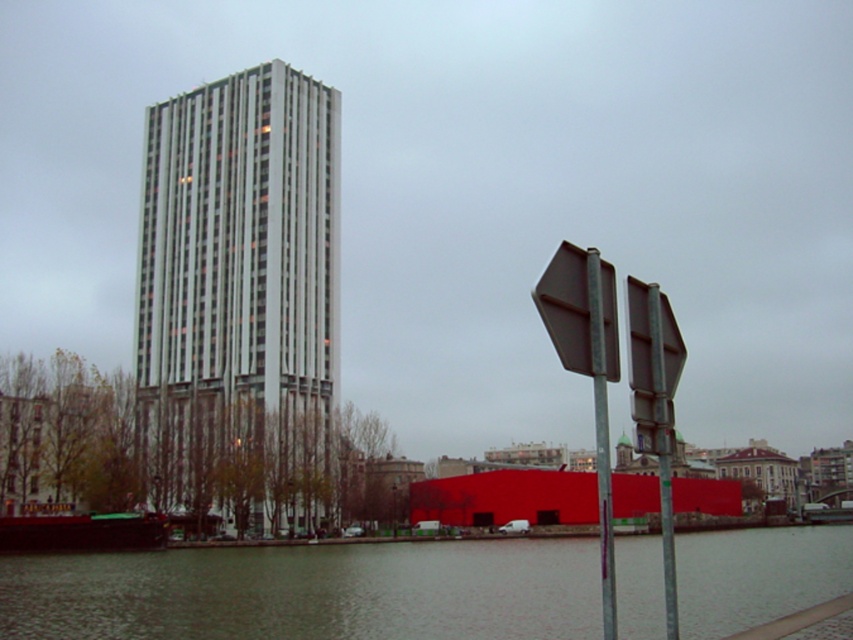
Question: Is white glass building at center positioned behind smooth concrete river at lower center?

Choices:
 (A) no
 (B) yes

Answer: (B)

Question: Which point is farther to the camera?

Choices:
 (A) metallic gray pole at center-right
 (B) smooth concrete river at lower center
 (C) metallic gray hexagonal sign at right

Answer: (C)

Question: Considering the real-world distances, which object is farthest from the metallic gray hexagonal sign at right?

Choices:
 (A) smooth concrete river at lower center
 (B) white glass building at center
 (C) metallic gray pole at center-right

Answer: (B)

Question: Among these objects, which one is farthest from the camera?

Choices:
 (A) white glass building at center
 (B) brown metallic sign at center-right
 (C) smooth concrete river at lower center

Answer: (A)

Question: Considering the relative positions of brown metallic sign at center-right and metallic gray hexagonal sign at right in the image provided, where is brown metallic sign at center-right located with respect to metallic gray hexagonal sign at right?

Choices:
 (A) above
 (B) below

Answer: (A)

Question: Does white glass building at center have a greater width compared to metallic gray hexagonal sign at right?

Choices:
 (A) yes
 (B) no

Answer: (A)